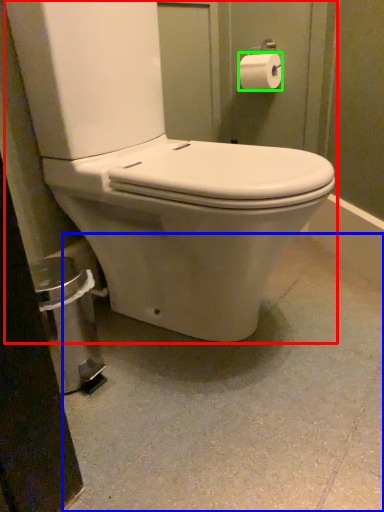
Question: Which object is the closest to the toilet (highlighted by a red box)? Choose among these: concrete (highlighted by a blue box) or toilet paper (highlighted by a green box).

Choices:
 (A) concrete
 (B) toilet paper

Answer: (A)